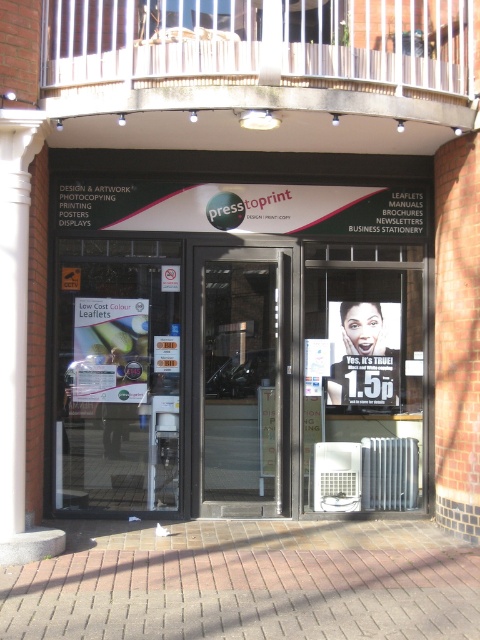
Question: Can you confirm if brick pavement at lower center is wider than transparent glass door at center?

Choices:
 (A) no
 (B) yes

Answer: (B)

Question: Among these objects, which one is nearest to the camera?

Choices:
 (A) white glossy signboard at center
 (B) matte plastic poster at center

Answer: (A)

Question: Which of these objects is positioned farthest from the metallic air conditioner at center?

Choices:
 (A) matte paper leaflets at center
 (B) white glossy signboard at center
 (C) transparent glass door at center
 (D) transparent glass vending machine at center

Answer: (A)

Question: Which point appears closest to the camera in this image?

Choices:
 (A) (252, 365)
 (B) (148, 381)
 (C) (86, 548)
 (D) (374, 378)

Answer: (C)

Question: Is white glossy signboard at center positioned at the back of transparent glass door at center?

Choices:
 (A) yes
 (B) no

Answer: (B)

Question: Is transparent glass door at center above matte paper leaflets at center?

Choices:
 (A) no
 (B) yes

Answer: (A)